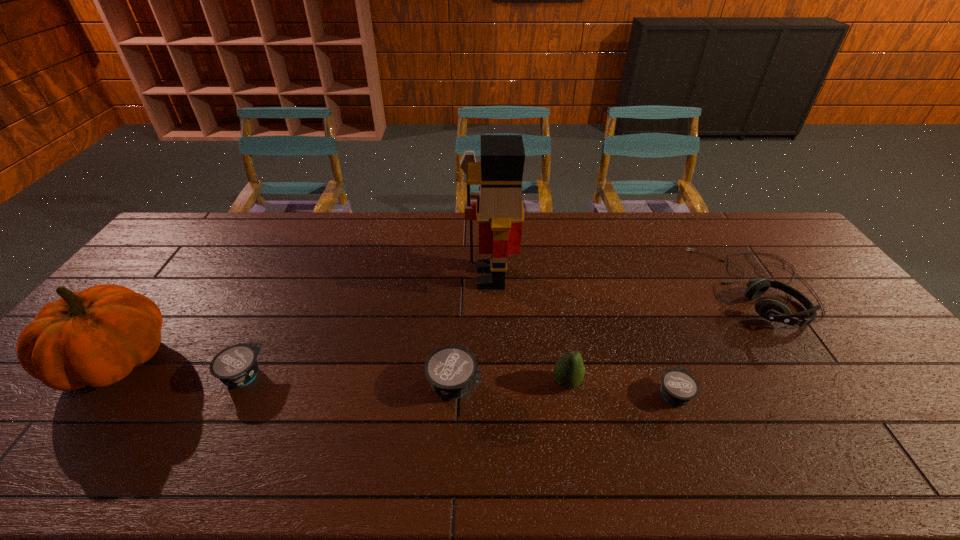
Where is `headset`? The height and width of the screenshot is (540, 960). headset is located at coordinates (770, 308).

Locate an element on the screen. vacant region located on the left of the second object from left to right is located at coordinates (104, 376).

The width and height of the screenshot is (960, 540). Identify the location of free region located on the right of the fifth tallest object. (510, 385).

Find the location of a particular element. This screenshot has width=960, height=540. free space located on the right of the rightmost yogurt is located at coordinates (813, 394).

The height and width of the screenshot is (540, 960). Find the location of `vacant point located on the left of the third object from right to left`. vacant point located on the left of the third object from right to left is located at coordinates (410, 383).

I want to click on blank area located 0.180m in front of the tallest object holding the staff, so (x=406, y=277).

What are the coordinates of `vacant space located in front of the tallest object holding the staff` in the screenshot? It's located at (403, 277).

I want to click on vacant space located 0.190m in front of the tallest object holding the staff, so click(403, 277).

Locate an element on the screen. free spot located 0.230m on the back of the pumpkin is located at coordinates (188, 270).

You are a GUI agent. You are given a task and a screenshot of the screen. Output one action in this format:
    pyautogui.click(x=<x>, y=<y>)
    Task: Click on the vacant space located on the outer surface of the rightmost object
    Image resolution: width=960 pixels, height=540 pixels.
    Given the screenshot: What is the action you would take?
    pyautogui.click(x=675, y=287)